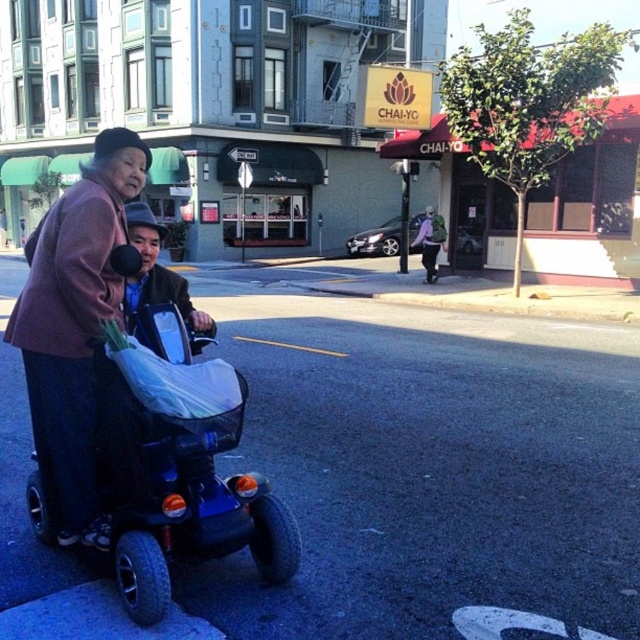
In the scene shown: Is blue plastic scooter at lower left to the right of dark purple fabric jacket at left from the viewer's perspective?

Indeed, blue plastic scooter at lower left is positioned on the right side of dark purple fabric jacket at left.

Between point (192, 518) and point (77, 529), which one is positioned behind?

Point (77, 529)

This screenshot has height=640, width=640. What do you see at coordinates (180, 496) in the screenshot? I see `blue plastic scooter at lower left` at bounding box center [180, 496].

Locate an element on the screen. The height and width of the screenshot is (640, 640). blue plastic scooter at lower left is located at coordinates (180, 496).